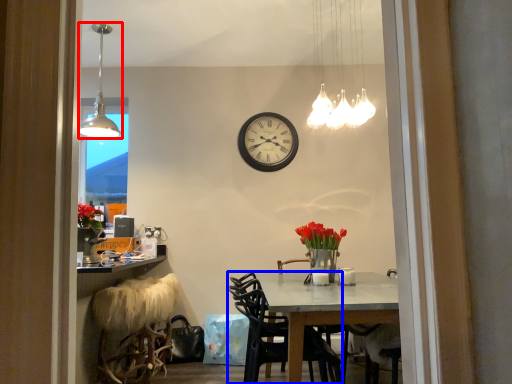
Question: Among these objects, which one is farthest to the camera, lamp (highlighted by a red box) or chair (highlighted by a blue box)?

Choices:
 (A) lamp
 (B) chair

Answer: (A)